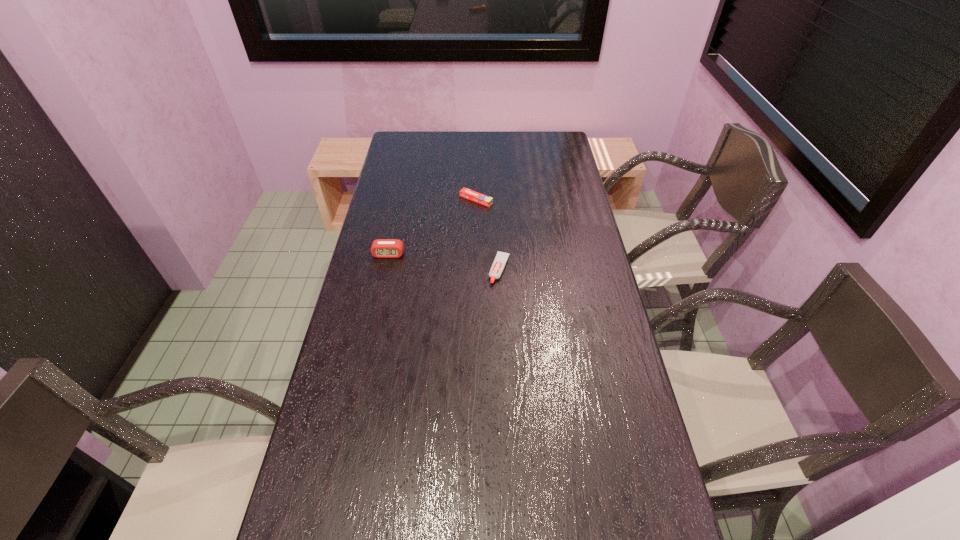
The image size is (960, 540). In order to click on the tallest object in this screenshot , I will do `click(381, 248)`.

This screenshot has height=540, width=960. Find the location of `alarm clock`. alarm clock is located at coordinates (381, 248).

Identify the location of the second tallest object. The width and height of the screenshot is (960, 540). (498, 265).

Identify the location of the taller toothpaste. (498, 265).

Identify the location of the farthest object. (466, 193).

Find the location of a particular element. The height and width of the screenshot is (540, 960). the shortest object is located at coordinates (466, 193).

Locate an element on the screen. Image resolution: width=960 pixels, height=540 pixels. free spot located on the front-facing side of the leftmost object is located at coordinates [x=370, y=343].

This screenshot has height=540, width=960. I want to click on vacant space located on the right of the taller toothpaste, so (x=566, y=269).

Identify the location of vacant space situated on the left of the farther toothpaste. This screenshot has height=540, width=960. (444, 200).

At what (x,y) coordinates should I click in order to perform the action: click on object that is positioned at the left edge. Please return your answer as a coordinate pair (x, y). Image resolution: width=960 pixels, height=540 pixels. Looking at the image, I should click on (381, 248).